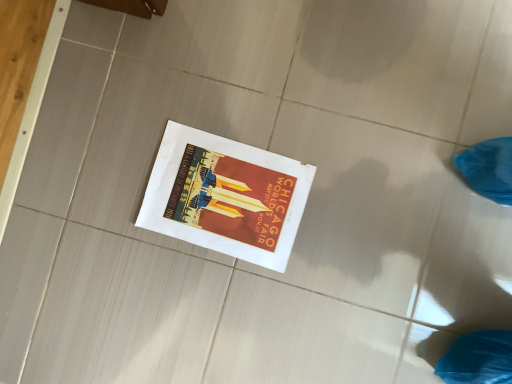
The image size is (512, 384). Identify the location of free location to the left of white paper poster at center. (149, 282).